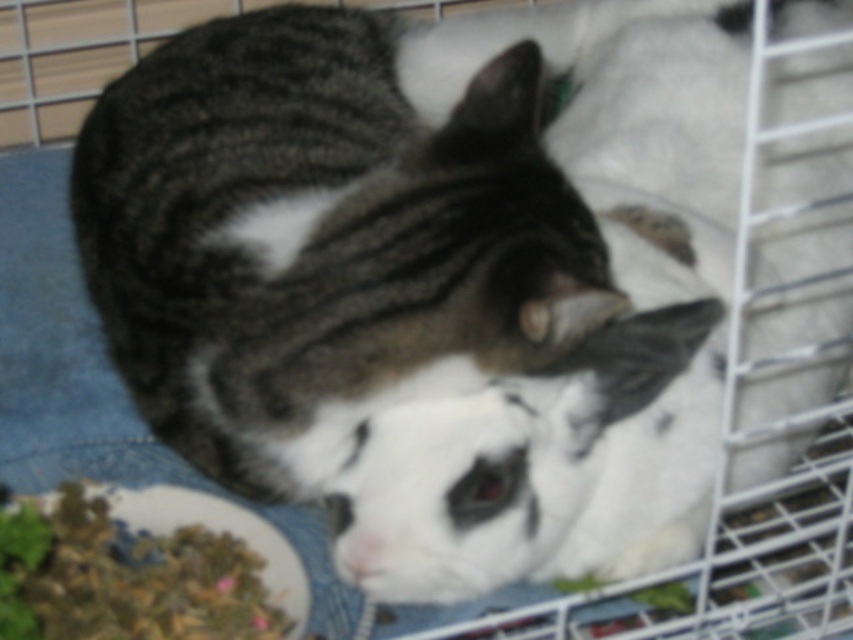
Can you confirm if gray tabby cat at center is positioned to the right of green leafy material at lower left?

Indeed, gray tabby cat at center is positioned on the right side of green leafy material at lower left.

What do you see at coordinates (320, 241) in the screenshot? I see `gray tabby cat at center` at bounding box center [320, 241].

Find the location of a particular element. The height and width of the screenshot is (640, 853). gray tabby cat at center is located at coordinates (320, 241).